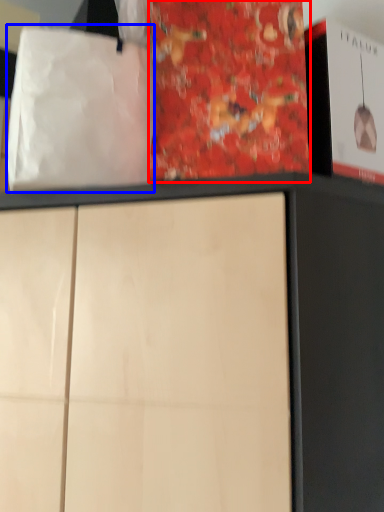
Question: Which point is closer to the camera, paperback book (highlighted by a red box) or tote bag (highlighted by a blue box)?

Choices:
 (A) paperback book
 (B) tote bag

Answer: (B)